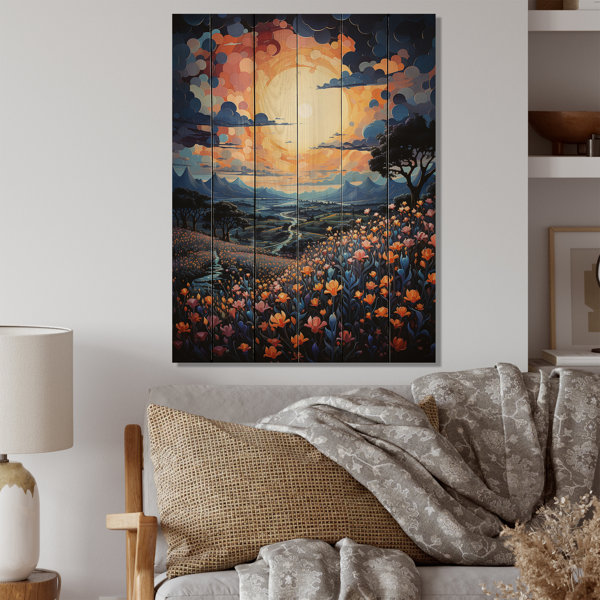
Locate an element on the screen. This screenshot has height=600, width=600. white lamp is located at coordinates (21, 531).